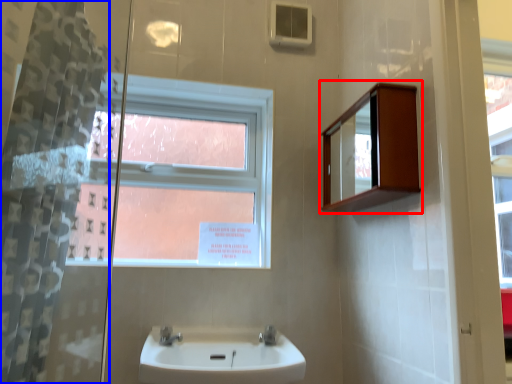
Question: Which object appears farthest to the camera in this image, medicine cabinet (highlighted by a red box) or shower curtain (highlighted by a blue box)?

Choices:
 (A) medicine cabinet
 (B) shower curtain

Answer: (A)